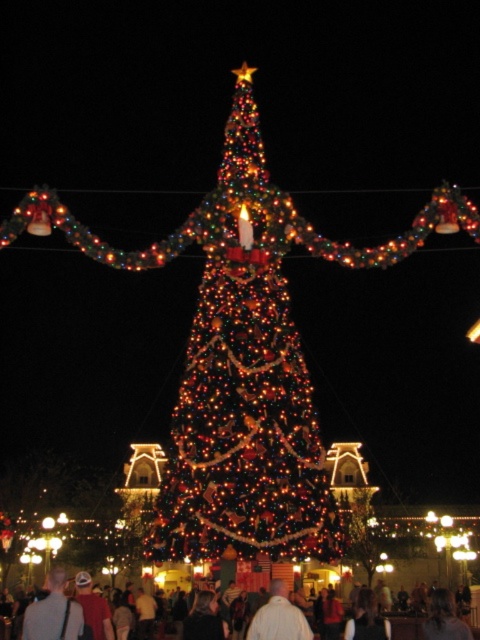
Question: Which point is farther to the camera?

Choices:
 (A) (407, 636)
 (B) (256, 628)

Answer: (A)

Question: Can you confirm if dark brown leather jacket at lower right is positioned below dark gray sweater at lower center?

Choices:
 (A) yes
 (B) no

Answer: (A)

Question: Which of the following is the closest to the observer?

Choices:
 (A) dark gray sweater at lower center
 (B) white cotton shirt at center

Answer: (A)

Question: Is dark brown leather jacket at lower right thinner than dark gray sweater at lower center?

Choices:
 (A) yes
 (B) no

Answer: (B)

Question: Is white matte shirt at center positioned behind dark gray sweater at lower center?

Choices:
 (A) yes
 (B) no

Answer: (B)

Question: Which point appears closest to the camera in this image?

Choices:
 (A) (359, 625)
 (B) (431, 620)

Answer: (A)